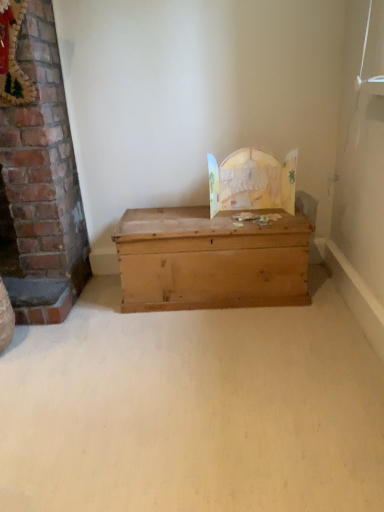
Where is `free location in front of brick fireplace at left`? This screenshot has width=384, height=512. free location in front of brick fireplace at left is located at coordinates (99, 298).